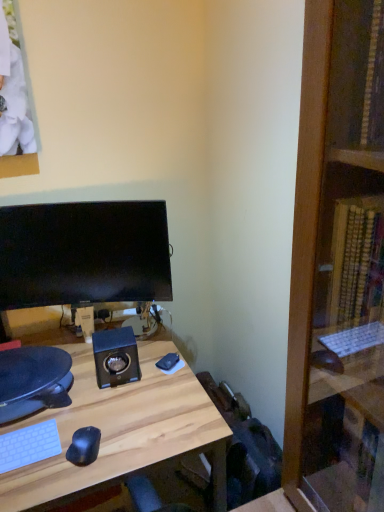
Locate an element on the screen. light wood desk at center is located at coordinates pos(121,432).

This screenshot has width=384, height=512. What do you see at coordinates (121, 432) in the screenshot?
I see `light wood desk at center` at bounding box center [121, 432].

What is the approximate width of matte black monitor at center?

The width of matte black monitor at center is 1.89 inches.

Locate an element on the screen. This screenshot has height=512, width=384. matte black monitor at center is located at coordinates (84, 254).

This screenshot has width=384, height=512. What do you see at coordinates (84, 254) in the screenshot?
I see `matte black monitor at center` at bounding box center [84, 254].

Locate an element on the screen. light wood desk at center is located at coordinates (121, 432).

In the scene shown: Considering the relative positions of light wood desk at center and matte black monitor at center in the image provided, is light wood desk at center to the left or to the right of matte black monitor at center?

light wood desk at center is to the right of matte black monitor at center.

Is the depth of light wood desk at center less than that of matte black monitor at center?

Yes, light wood desk at center is closer to the camera.

Considering the points (138, 384) and (22, 307), which point is in front, point (138, 384) or point (22, 307)?

The point (138, 384) is in front.

Consider the image. From the image's perspective, is light wood desk at center over matte black monitor at center?

No, from the image's perspective, light wood desk at center is not above matte black monitor at center.

From a real-world perspective, which is physically above, light wood desk at center or matte black monitor at center?

matte black monitor at center is physically above.

Is light wood desk at center wider than matte black monitor at center?

Correct, the width of light wood desk at center exceeds that of matte black monitor at center.

Which of these two, light wood desk at center or matte black monitor at center, stands taller?

light wood desk at center is taller.

Looking at this image, who is bigger, light wood desk at center or matte black monitor at center?

With larger size is light wood desk at center.

Is light wood desk at center spatially inside matte black monitor at center, or outside of it?

light wood desk at center is spatially situated outside matte black monitor at center.

Are light wood desk at center and matte black monitor at center far apart?

light wood desk at center is near matte black monitor at center, not far away.

Could you tell me if light wood desk at center is facing matte black monitor at center?

Yes, light wood desk at center is oriented towards matte black monitor at center.

How far apart are light wood desk at center and matte black monitor at center?

light wood desk at center is 15.57 inches from matte black monitor at center.

Identify the location of computer monitor above the light wood desk at center (from the image's perspective). (84, 254).

Considering the relative positions of matte black monitor at center and light wood desk at center in the image provided, is matte black monitor at center to the right of light wood desk at center from the viewer's perspective?

No, matte black monitor at center is not to the right of light wood desk at center.

Is matte black monitor at center positioned behind light wood desk at center?

That is True.

Considering the points (50, 267) and (82, 371), which point is behind, point (50, 267) or point (82, 371)?

Positioned behind is point (82, 371).

From the image's perspective, which is above, matte black monitor at center or light wood desk at center?

matte black monitor at center, from the image's perspective.

From a real-world perspective, relative to light wood desk at center, is matte black monitor at center vertically above or below?

matte black monitor at center is above light wood desk at center.

Does matte black monitor at center have a lesser width compared to light wood desk at center?

Indeed, matte black monitor at center has a lesser width compared to light wood desk at center.

Who is taller, matte black monitor at center or light wood desk at center?

light wood desk at center.

Considering the sizes of objects matte black monitor at center and light wood desk at center in the image provided, who is smaller, matte black monitor at center or light wood desk at center?

Smaller between the two is matte black monitor at center.

Is matte black monitor at center located outside light wood desk at center?

matte black monitor at center lies outside light wood desk at center's area.

Are matte black monitor at center and light wood desk at center located far from each other?

No, matte black monitor at center is in close proximity to light wood desk at center.

Is matte black monitor at center oriented away from light wood desk at center?

No, matte black monitor at center's orientation is not away from light wood desk at center.

The image size is (384, 512). I want to click on desk in front of the matte black monitor at center, so click(121, 432).

Locate an element on the screen. The image size is (384, 512). computer monitor above the light wood desk at center (from the image's perspective) is located at coordinates (84, 254).

Find the location of a particular element. The width and height of the screenshot is (384, 512). desk below the matte black monitor at center (from a real-world perspective) is located at coordinates (121, 432).